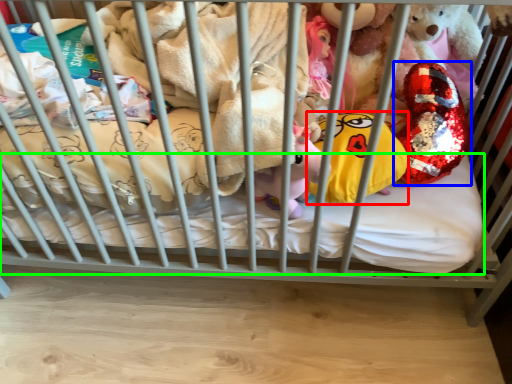
Question: Based on their relative distances, which object is nearer to pillow (highlighted by a red box)? Choose from toy (highlighted by a blue box) and mattress (highlighted by a green box).

Choices:
 (A) toy
 (B) mattress

Answer: (A)